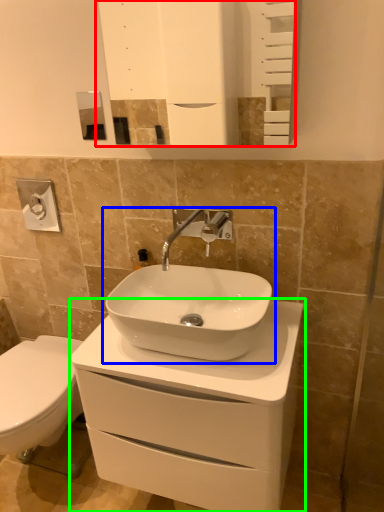
Question: Considering the real-world distances, which object is farthest from mirror (highlighted by a red box)? sink (highlighted by a blue box) or bathroom cabinet (highlighted by a green box)?

Choices:
 (A) sink
 (B) bathroom cabinet

Answer: (B)